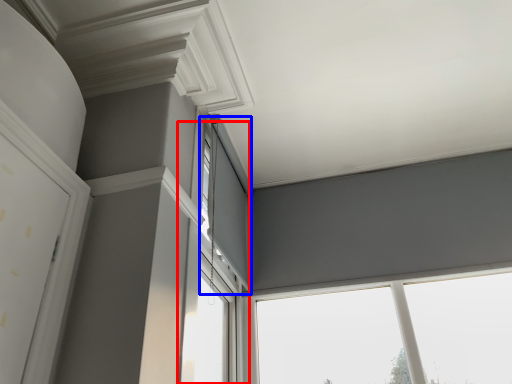
Question: Which point is further to the camera, window (highlighted by a red box) or window (highlighted by a blue box)?

Choices:
 (A) window
 (B) window

Answer: (B)